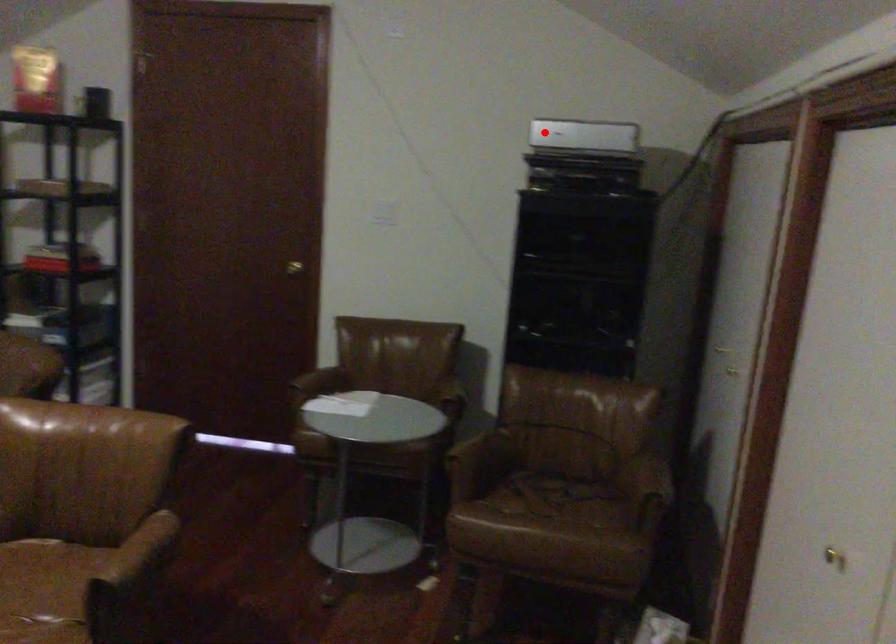
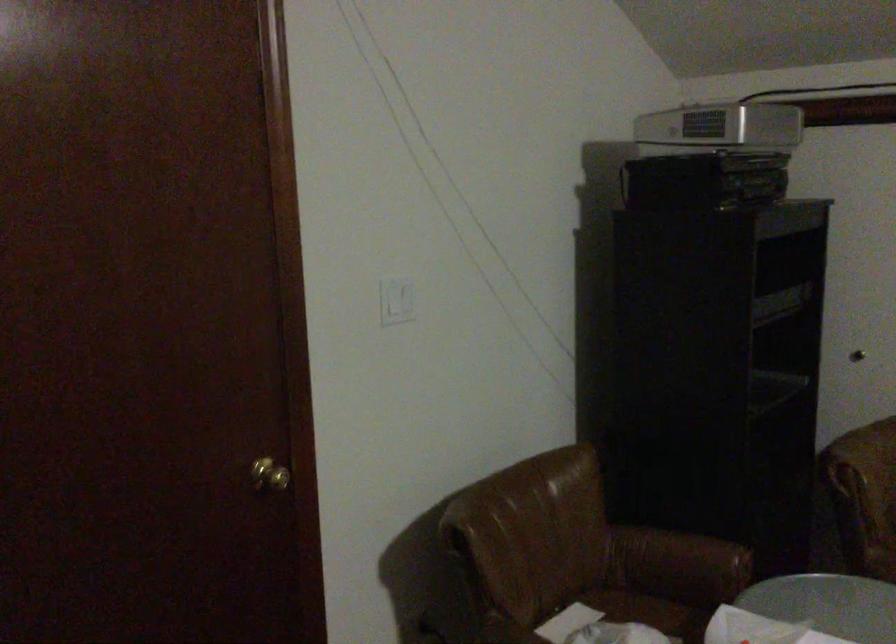
Question: I am providing you with two images of the same scene from different viewpoints. Image1 has a red point marked. In image2, the corresponding 3D location appears at what relative position? Reply with the corresponding letter.

Choices:
 (A) Closer
 (B) Farther

Answer: (A)